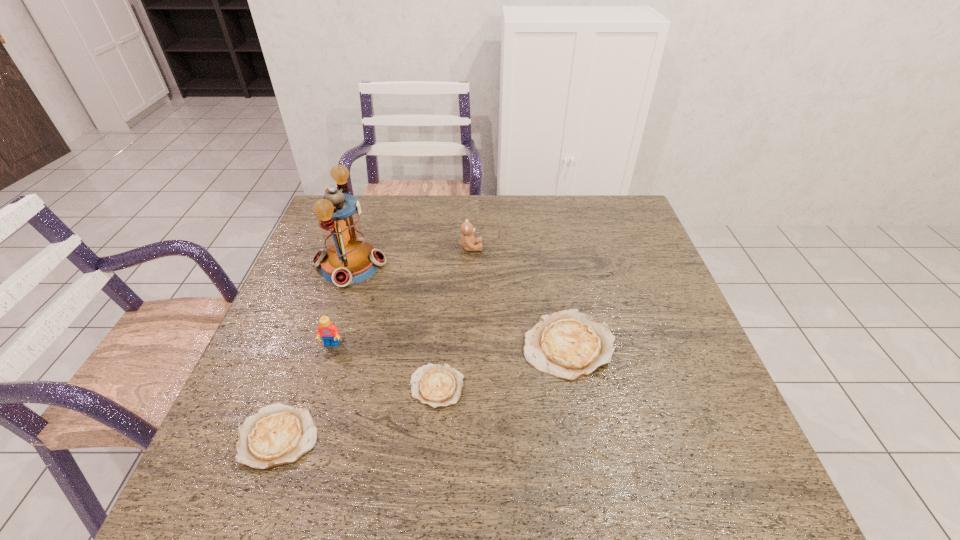
In order to click on vacant space located 0.250m on the left of the shortest object in this screenshot , I will do `click(296, 387)`.

You are a GUI agent. You are given a task and a screenshot of the screen. Output one action in this format:
    pyautogui.click(x=<x>, y=<y>)
    Task: Click on the free location located 0.120m on the left of the rightmost object
    
    Given the screenshot: What is the action you would take?
    pyautogui.click(x=472, y=345)

This screenshot has height=540, width=960. I want to click on vacant point located 0.290m on the front-facing side of the lantern, so click(488, 265).

You are a GUI agent. You are given a task and a screenshot of the screen. Output one action in this format:
    pyautogui.click(x=<x>, y=<y>)
    Task: Click on the vacant space located 0.370m on the front-facing side of the teddy bear
    The height and width of the screenshot is (540, 960).
    Given the screenshot: What is the action you would take?
    pyautogui.click(x=605, y=247)

Where is `free spot located on the face of the Lego`? The width and height of the screenshot is (960, 540). free spot located on the face of the Lego is located at coordinates (309, 414).

I want to click on quiche that is at the left edge, so click(x=278, y=434).

The width and height of the screenshot is (960, 540). I want to click on lantern that is at the left edge, so click(347, 259).

Locate an element on the screen. Lego that is at the left edge is located at coordinates (327, 330).

Locate an element on the screen. object that is positioned at the near left corner is located at coordinates (278, 434).

The width and height of the screenshot is (960, 540). In order to click on free space at the far edge of the desktop in this screenshot , I will do `click(444, 208)`.